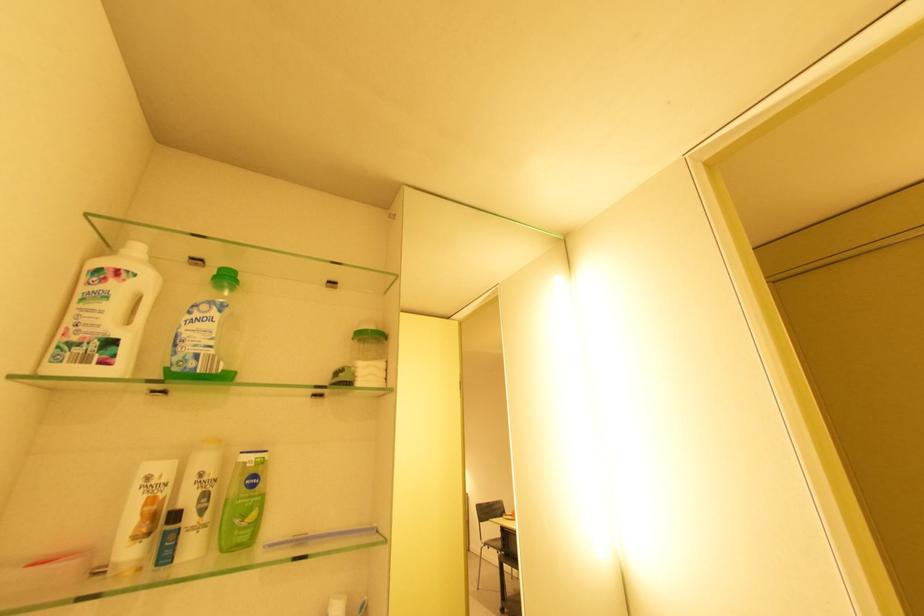
The width and height of the screenshot is (924, 616). What are the coordinates of `green bottle cap` in the screenshot? It's located at (225, 276).